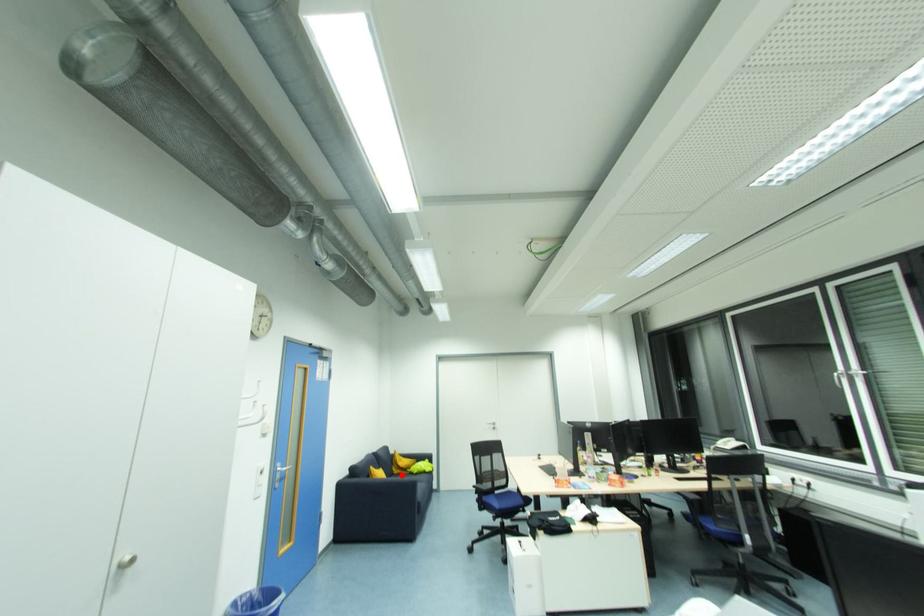
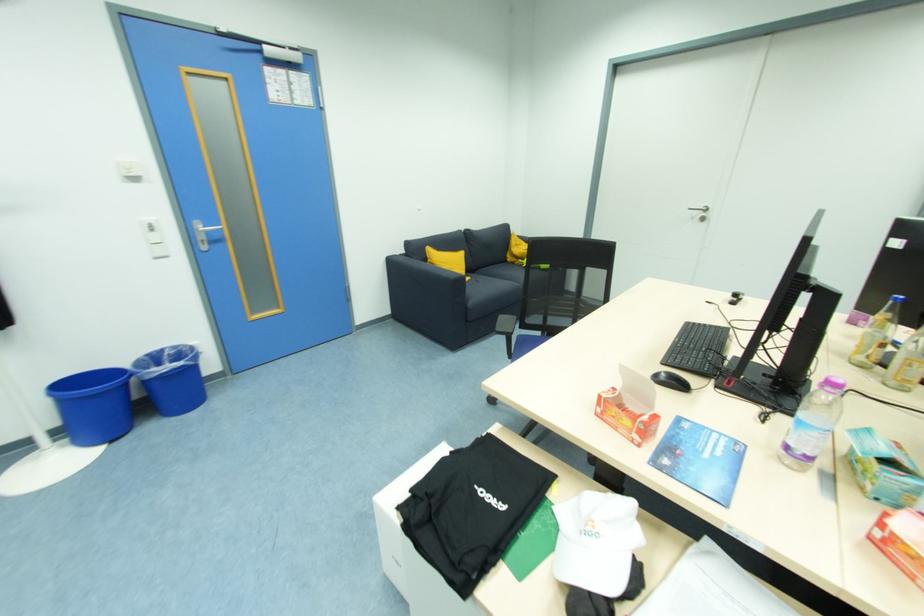
Question: A red point is marked in image1. In image2, is the corresponding 3D point closer to the camera or farther? Reply with the corresponding letter.

Choices:
 (A) The corresponding 3D point is closer.
 (B) The corresponding 3D point is farther.

Answer: (A)